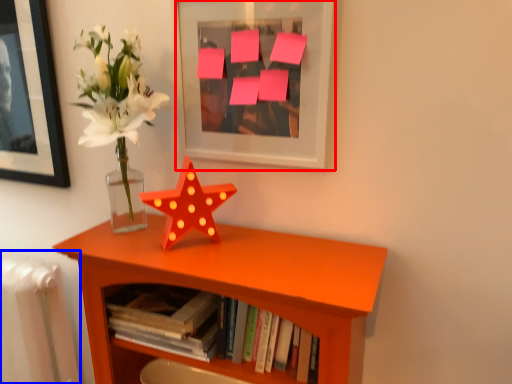
Question: Which of the following is the farthest to the observer, picture frame (highlighted by a red box) or radiator (highlighted by a blue box)?

Choices:
 (A) picture frame
 (B) radiator

Answer: (B)